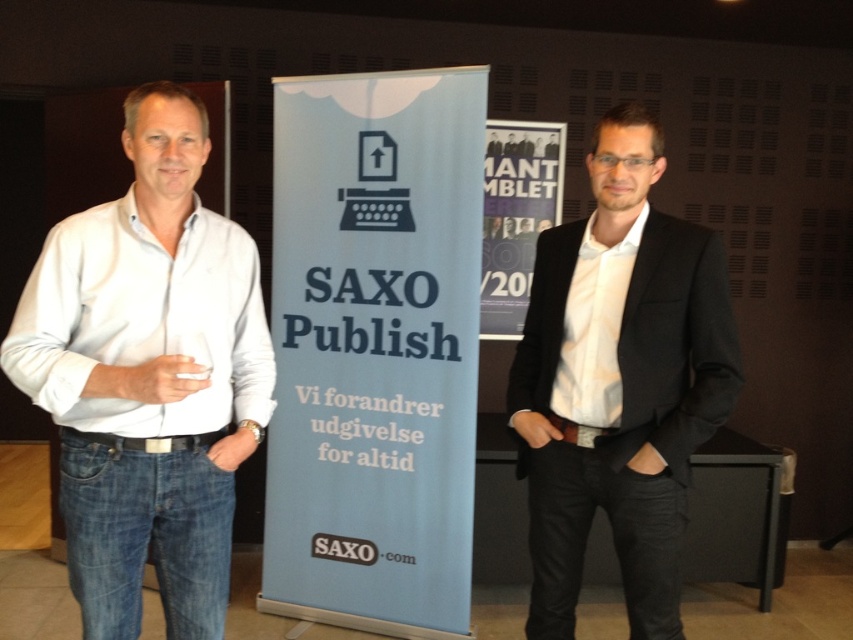
Who is lower down, blue paper banner at center or black smooth blazer at center?

black smooth blazer at center is below.

Looking at this image, is blue paper banner at center to the right of black smooth blazer at center from the viewer's perspective?

In fact, blue paper banner at center is to the left of black smooth blazer at center.

Does point (281, 413) come farther from viewer compared to point (527, 323)?

That is True.

You are a GUI agent. You are given a task and a screenshot of the screen. Output one action in this format:
    pyautogui.click(x=<x>, y=<y>)
    Task: Click on the blue paper banner at center
    
    Given the screenshot: What is the action you would take?
    pyautogui.click(x=374, y=349)

Is blue paper banner at center shorter than white cotton shirt at left?

In fact, blue paper banner at center may be taller than white cotton shirt at left.

Is blue paper banner at center thinner than white cotton shirt at left?

In fact, blue paper banner at center might be wider than white cotton shirt at left.

Locate an element on the screen. blue paper banner at center is located at coordinates (374, 349).

Does white cotton shirt at left appear on the right side of black smooth blazer at center?

No, white cotton shirt at left is not to the right of black smooth blazer at center.

Where is `white cotton shirt at left`? This screenshot has height=640, width=853. white cotton shirt at left is located at coordinates (148, 376).

Where is `white cotton shirt at left`? The height and width of the screenshot is (640, 853). white cotton shirt at left is located at coordinates (148, 376).